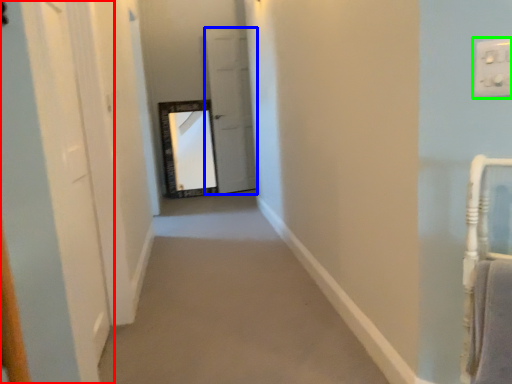
Question: Based on their relative distances, which object is farther from door (highlighted by a red box)? Choose from door (highlighted by a blue box) and electric outlet (highlighted by a green box).

Choices:
 (A) door
 (B) electric outlet

Answer: (A)